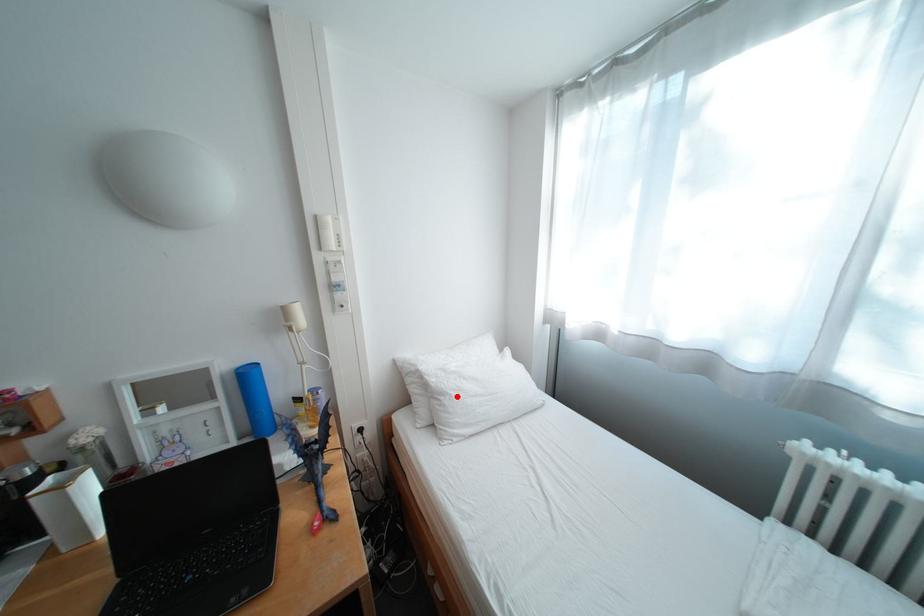
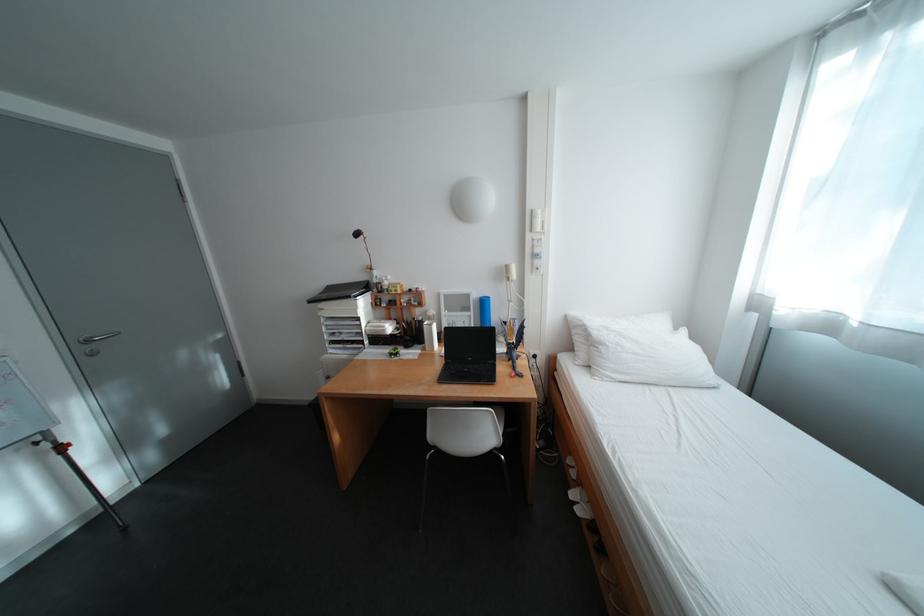
Where in the second image is the point corresponding to the highlighted location from the first image?

(614, 346)